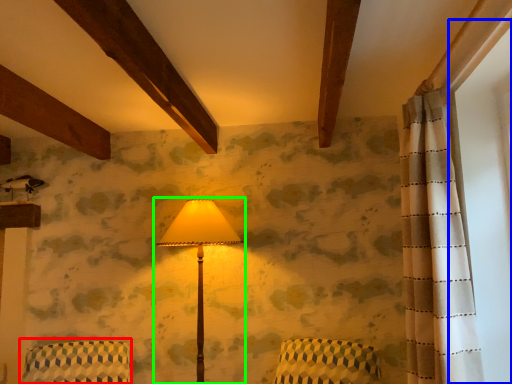
Question: Which object is the farthest from armchair (highlighted by a red box)? Choose among these: window screen (highlighted by a blue box) or lamp (highlighted by a green box).

Choices:
 (A) window screen
 (B) lamp

Answer: (A)